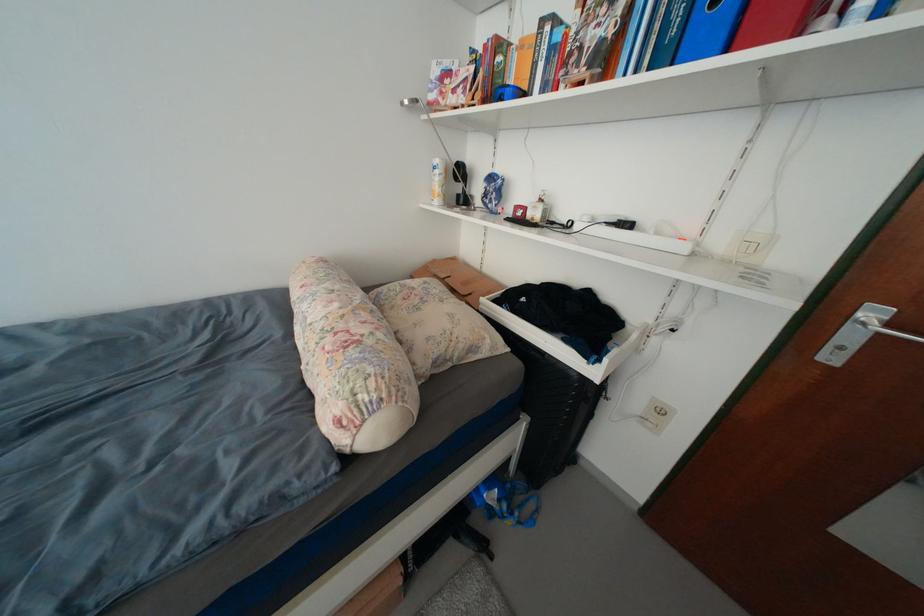
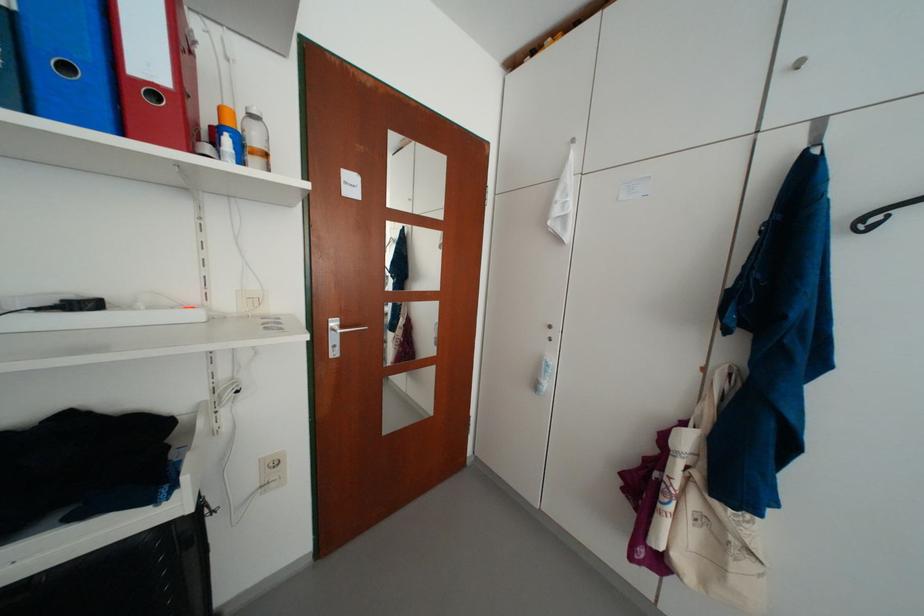
Question: The images are taken continuously from a first-person perspective. In which direction is your viewpoint rotating?

Choices:
 (A) Left
 (B) Right
 (C) Up
 (D) Down

Answer: (B)